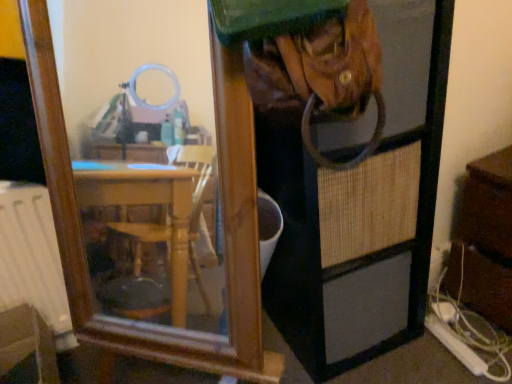
Question: From the image's perspective, relative to brown woven screen door at center, is brushed metal water at lower left above or below?

Choices:
 (A) above
 (B) below

Answer: (B)

Question: From their relative heights in the image, would you say brushed metal water at lower left is taller or shorter than brown woven screen door at center?

Choices:
 (A) short
 (B) tall

Answer: (A)

Question: Estimate the real-world distances between objects in this image. Which object is closer to the brushed metal water at lower left?

Choices:
 (A) brown woven screen door at center
 (B) brown wooden dresser at right

Answer: (A)

Question: Which of these objects is positioned closest to the brown woven screen door at center?

Choices:
 (A) brushed metal water at lower left
 (B) brown wooden dresser at right

Answer: (B)